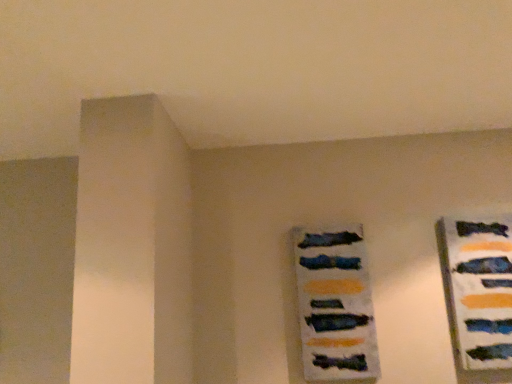
Question: In the image, is matte blue picture frame at center-right on the left side or the right side of matte blue tie at right?

Choices:
 (A) left
 (B) right

Answer: (A)

Question: In the image, is matte blue picture frame at center-right positioned in front of or behind matte blue tie at right?

Choices:
 (A) front
 (B) behind

Answer: (B)

Question: Considering the positions of matte blue picture frame at center-right and matte blue tie at right in the image, is matte blue picture frame at center-right wider or thinner than matte blue tie at right?

Choices:
 (A) wide
 (B) thin

Answer: (A)

Question: Would you say matte blue tie at right is to the left or to the right of matte blue picture frame at center-right in the picture?

Choices:
 (A) right
 (B) left

Answer: (A)

Question: Is matte blue tie at right in front of or behind matte blue picture frame at center-right in the image?

Choices:
 (A) behind
 (B) front

Answer: (B)

Question: Is matte blue tie at right inside or outside of matte blue picture frame at center-right?

Choices:
 (A) inside
 (B) outside

Answer: (B)

Question: Is matte blue tie at right taller or shorter than matte blue picture frame at center-right?

Choices:
 (A) tall
 (B) short

Answer: (A)